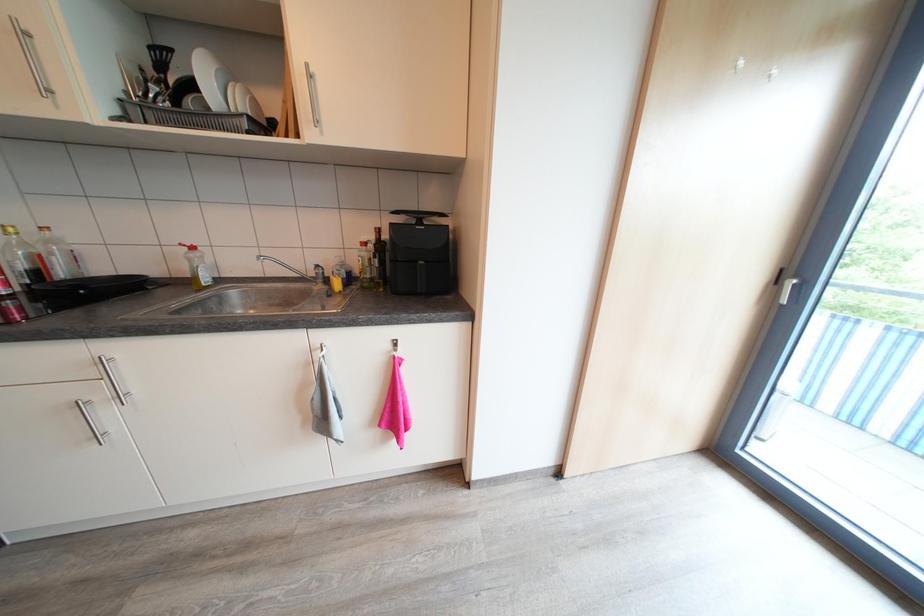
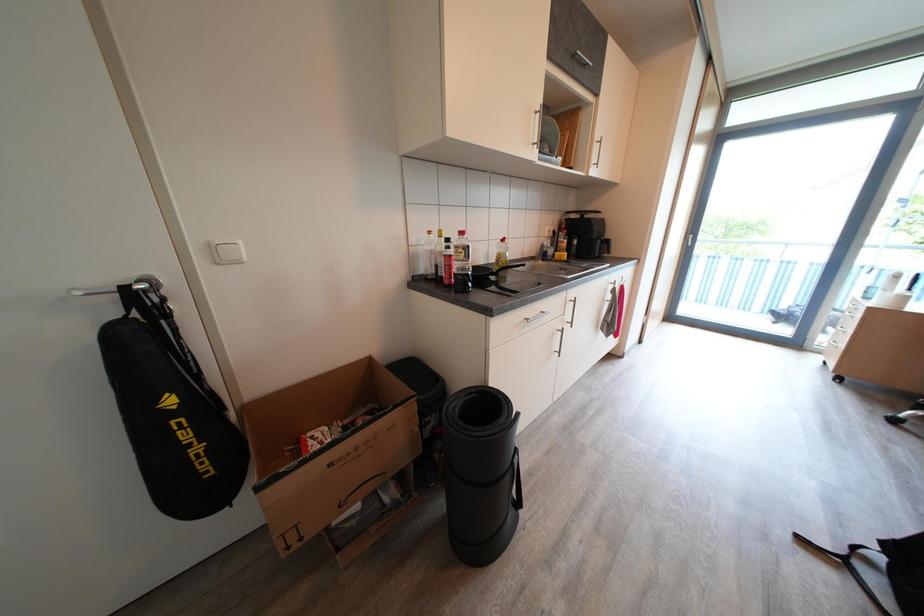
Question: Which direction would the cameraman need to move to produce the second image? Reply with the corresponding letter.

Choices:
 (A) Left
 (B) Right
 (C) Forward
 (D) Backward

Answer: (A)